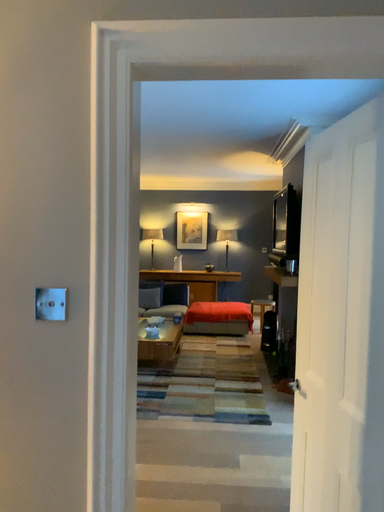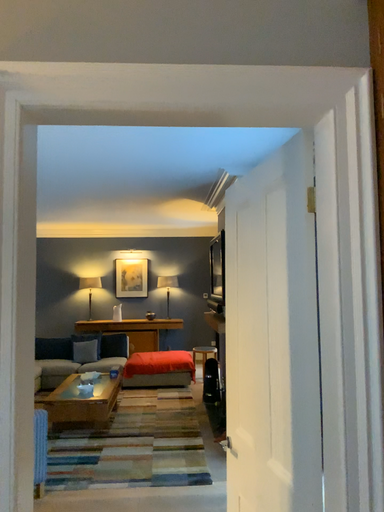
Question: Which way did the camera rotate in the video?

Choices:
 (A) rotated right
 (B) rotated left

Answer: (A)